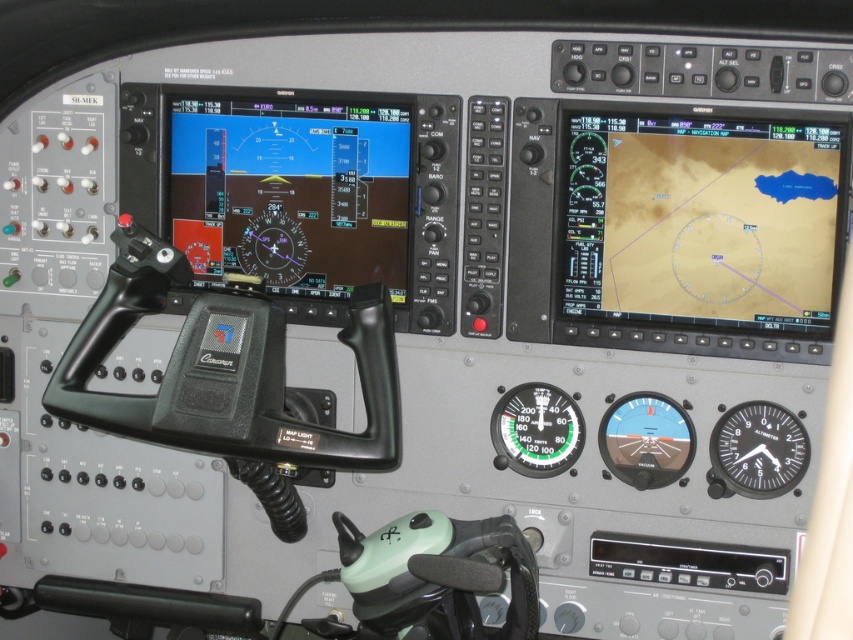
Is transparent glass vacuum gauge at center shorter than matte black compass at center?

No, transparent glass vacuum gauge at center is not shorter than matte black compass at center.

Is transparent glass vacuum gauge at center bigger than matte black compass at center?

Yes.

Between point (630, 408) and point (306, 252), which one is positioned behind?

Positioned behind is point (306, 252).

You are a GUI agent. You are given a task and a screenshot of the screen. Output one action in this format:
    pyautogui.click(x=<x>, y=<y>)
    Task: Click on the transparent glass vacuum gauge at center
    This screenshot has width=853, height=640.
    Given the screenshot: What is the action you would take?
    pyautogui.click(x=646, y=440)

Does black glass altimeter at lower right appear on the left side of transparent glass vacuum gauge at center?

No, black glass altimeter at lower right is not to the left of transparent glass vacuum gauge at center.

Can you confirm if black glass altimeter at lower right is wider than transparent glass vacuum gauge at center?

Yes, black glass altimeter at lower right is wider than transparent glass vacuum gauge at center.

Is point (747, 417) behind point (642, 472)?

No, it is not.

Locate an element on the screen. This screenshot has width=853, height=640. black glass altimeter at lower right is located at coordinates (758, 449).

Is point (576, 428) positioned before point (265, 248)?

Yes, it is.

Which is in front, point (495, 465) or point (285, 253)?

Point (495, 465) is in front.

Is point (505, 422) less distant than point (294, 257)?

Yes, point (505, 422) is in front of point (294, 257).

Image resolution: width=853 pixels, height=640 pixels. In order to click on green matte gauge at center in this screenshot , I will do `click(537, 429)`.